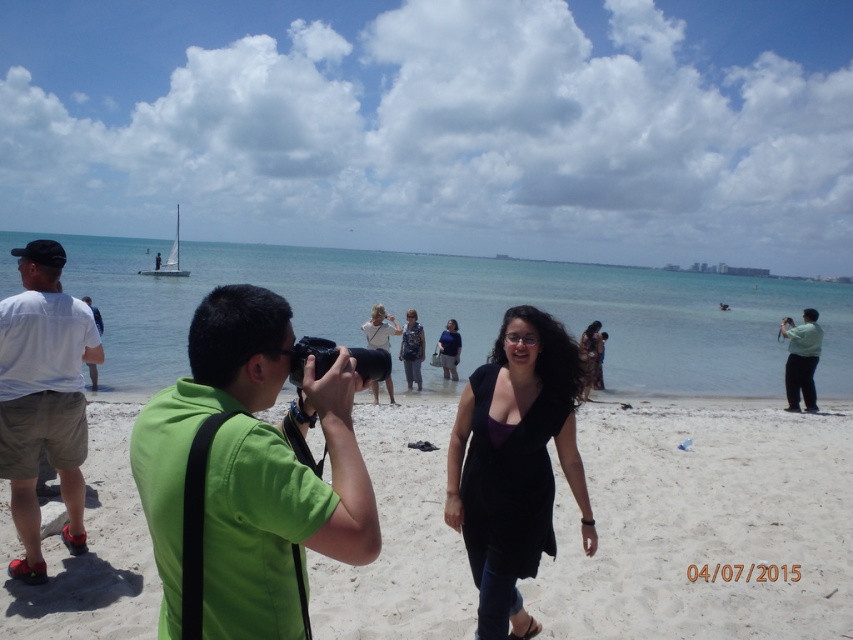
Is point (801, 548) in front of point (500, 442)?

No, it is behind (500, 442).

How much distance is there between white sandy beach at center and black matte dress at center?

9.62 feet

This screenshot has width=853, height=640. What do you see at coordinates (704, 524) in the screenshot?
I see `white sandy beach at center` at bounding box center [704, 524].

I want to click on white sandy beach at center, so click(x=704, y=524).

From the picture: Which of these two, white cotton shirt at center or dark blue dress at center, stands shorter?

Standing shorter between the two is dark blue dress at center.

Can you confirm if white cotton shirt at center is shorter than dark blue dress at center?

No, white cotton shirt at center is not shorter than dark blue dress at center.

Describe the element at coordinates (379, 326) in the screenshot. This screenshot has height=640, width=853. I see `white cotton shirt at center` at that location.

Image resolution: width=853 pixels, height=640 pixels. In order to click on white cotton shirt at center in this screenshot , I will do `click(379, 326)`.

Does green fabric shirt at left appear under brown textured dress at center?

Incorrect, green fabric shirt at left is not positioned below brown textured dress at center.

Does green fabric shirt at left come in front of brown textured dress at center?

Yes, green fabric shirt at left is in front of brown textured dress at center.

Does point (177, 410) come behind point (595, 339)?

No.

Where is `green fabric shirt at left`? green fabric shirt at left is located at coordinates (251, 472).